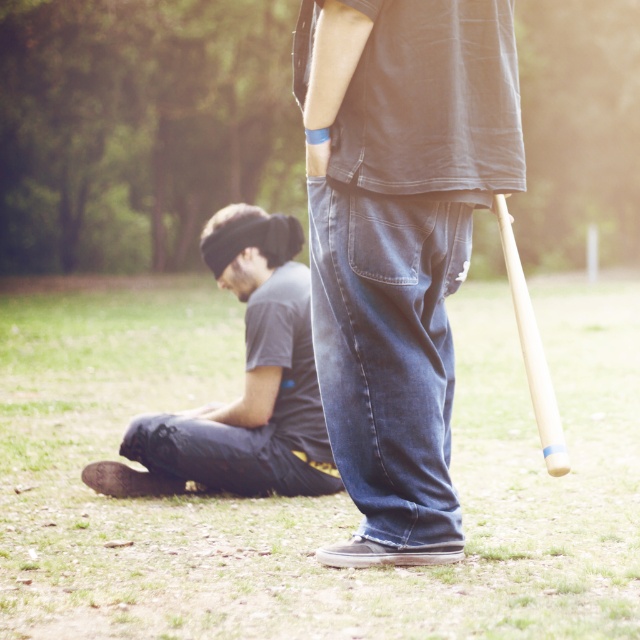
Who is more forward, [513,481] or [544,380]?

Point [544,380] is in front.

The image size is (640, 640). What do you see at coordinates (314, 497) in the screenshot?
I see `green grass at lower center` at bounding box center [314, 497].

The width and height of the screenshot is (640, 640). Find the location of `green grass at lower center`. green grass at lower center is located at coordinates (314, 497).

Identify the location of green grass at lower center. This screenshot has width=640, height=640. (314, 497).

Which is below, green grass at lower center or dark blue jeans at center?

green grass at lower center

Who is positioned more to the right, green grass at lower center or dark blue jeans at center?

dark blue jeans at center is more to the right.

Does point (532, 465) come behind point (369, 237)?

Yes, point (532, 465) is farther from viewer.

Locate an element on the screen. green grass at lower center is located at coordinates (314, 497).

What do you see at coordinates (397, 243) in the screenshot?
I see `dark blue jeans at center` at bounding box center [397, 243].

Who is taller, dark blue jeans at center or dark gray cotton shirt at lower left?

dark blue jeans at center is taller.

Which is behind, point (412, 410) or point (291, 401)?

The point (291, 401) is more distant.

Identify the location of dark blue jeans at center. This screenshot has width=640, height=640. (397, 243).